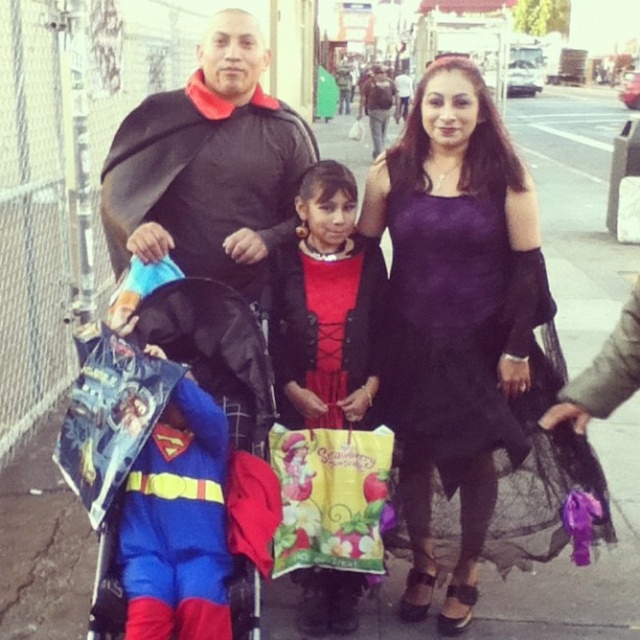
Question: Does purple satin dress at center come in front of matte purple dress at center?

Choices:
 (A) yes
 (B) no

Answer: (A)

Question: Does superman costume at center appear on the right side of black fabric baby carriage at center?

Choices:
 (A) no
 (B) yes

Answer: (B)

Question: Which object appears closest to the camera in this image?

Choices:
 (A) matte purple dress at center
 (B) purple satin dress at center
 (C) black fabric baby carriage at center

Answer: (C)

Question: Does black matte cape at center have a greater width compared to superman costume at center?

Choices:
 (A) yes
 (B) no

Answer: (A)

Question: Considering the real-world distances, which object is closest to the black fabric baby carriage at center?

Choices:
 (A) black matte cape at center
 (B) matte purple dress at center

Answer: (B)

Question: Which of these objects is positioned farthest from the matte purple dress at center?

Choices:
 (A) blue fabric superhero at lower left
 (B) purple satin dress at center
 (C) black fabric baby carriage at center
 (D) black matte cape at center

Answer: (A)